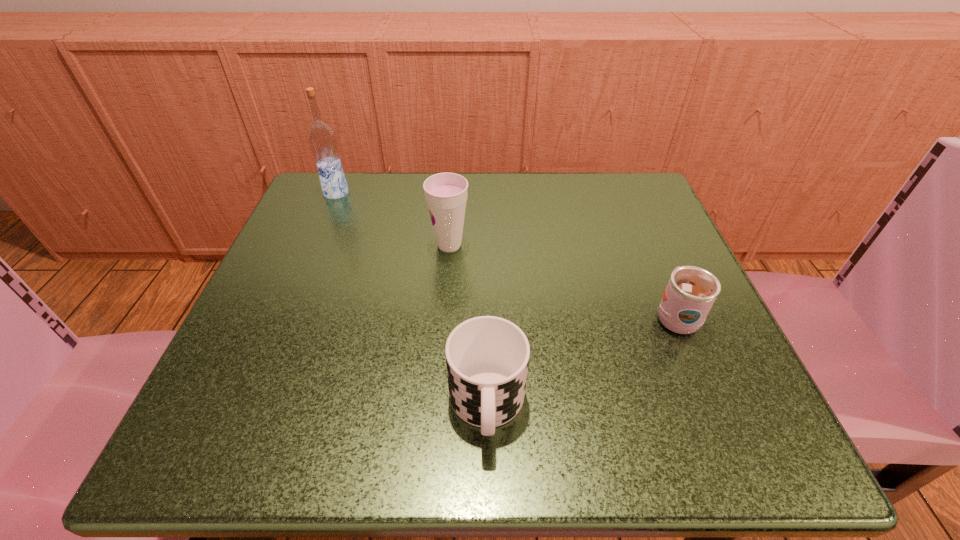
The height and width of the screenshot is (540, 960). In order to click on vacant region at the left edge of the desktop in this screenshot , I will do `click(286, 286)`.

In the image, there is a desktop. Identify the location of vacant space at the right edge. (666, 373).

This screenshot has width=960, height=540. I want to click on free point at the near left corner, so click(x=229, y=461).

I want to click on vacant space at the far right corner of the desktop, so click(x=628, y=209).

Image resolution: width=960 pixels, height=540 pixels. In the image, there is a desktop. Find the location of `vacant space at the near right corner`. vacant space at the near right corner is located at coordinates (646, 430).

Identify the location of empty location between the nearest cup and the rightmost object. The width and height of the screenshot is (960, 540). (581, 361).

Where is `vacant area between the second farthest object and the tallest object`? vacant area between the second farthest object and the tallest object is located at coordinates (393, 219).

Find the location of a particular element. free space between the tallest object and the farthest cup is located at coordinates (393, 219).

The width and height of the screenshot is (960, 540). I want to click on free space between the third farthest object and the farthest cup, so click(563, 281).

Locate an element on the screen. Image resolution: width=960 pixels, height=540 pixels. vacant space in between the farthest cup and the second farthest cup is located at coordinates (563, 281).